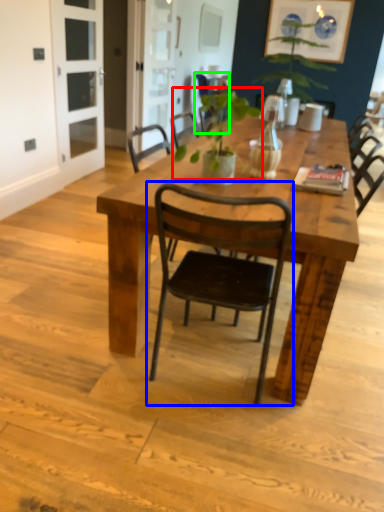
Question: Considering the real-world distances, which object is farthest from plant (highlighted by a red box)? chair (highlighted by a blue box) or chair (highlighted by a green box)?

Choices:
 (A) chair
 (B) chair

Answer: (A)